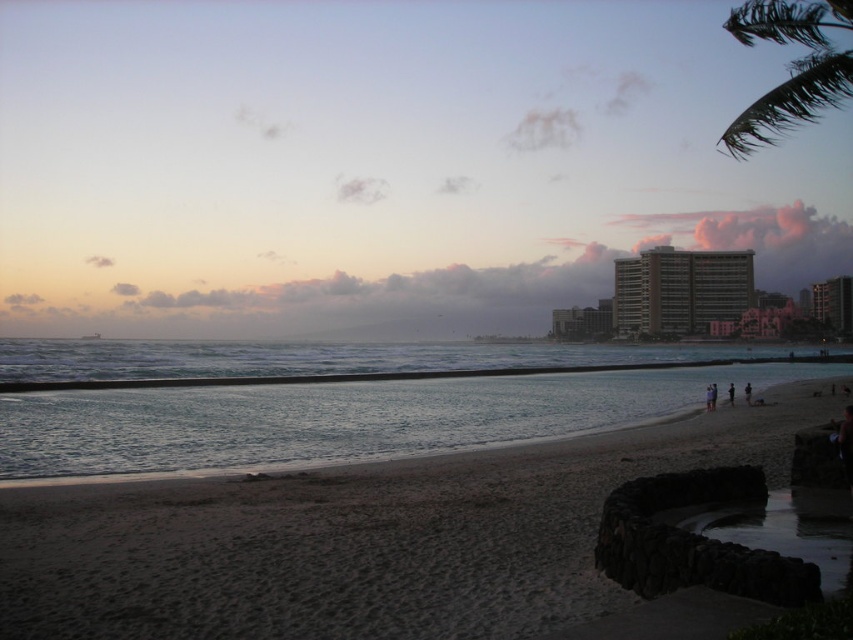
Question: Which of the following is the closest to the observer?

Choices:
 (A) dark blue fabric at lower right
 (B) clear blue water at center
 (C) dark skin textured person at lower right

Answer: (B)

Question: Is brown concrete building at center-right bigger than dark skin textured person at lower right?

Choices:
 (A) no
 (B) yes

Answer: (B)

Question: Based on their relative distances, which object is nearer to the dark skin textured person at lower right?

Choices:
 (A) brown concrete building at center-right
 (B) dark blue fabric at lower right

Answer: (B)

Question: From the image, what is the correct spatial relationship of dark sand at lower left in relation to clear blue water at center?

Choices:
 (A) right
 (B) left

Answer: (A)

Question: Is green leafy palm tree at upper right to the left of dark blue fabric at lower right from the viewer's perspective?

Choices:
 (A) yes
 (B) no

Answer: (B)

Question: Estimate the real-world distances between objects in this image. Which object is farther from the green leafy palm tree at upper right?

Choices:
 (A) clear blue water at center
 (B) brown concrete building at center-right
 (C) dark blue fabric at lower right

Answer: (C)